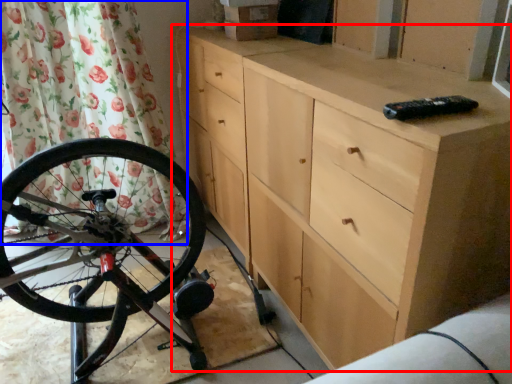
Question: Which object appears farthest to the camera in this image, chest of drawers (highlighted by a red box) or shower curtain (highlighted by a blue box)?

Choices:
 (A) chest of drawers
 (B) shower curtain

Answer: (B)